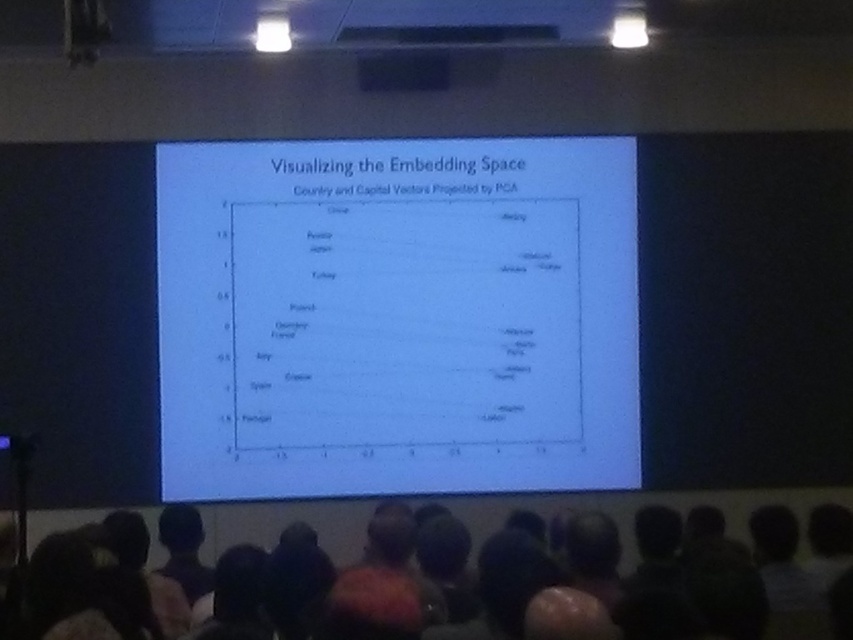
Between white paper at center and black matte rectangle at upper center, which one has less height?

black matte rectangle at upper center

Who is more forward, (x=519, y=184) or (x=357, y=61)?

Positioned in front is point (x=357, y=61).

This screenshot has width=853, height=640. Find the location of `white paper at center`. white paper at center is located at coordinates (397, 316).

The height and width of the screenshot is (640, 853). Describe the element at coordinates (286, 516) in the screenshot. I see `dark hair at lower center` at that location.

Which is behind, point (502, 513) or point (440, 52)?

Positioned behind is point (502, 513).

Image resolution: width=853 pixels, height=640 pixels. What are the coordinates of `dark hair at lower center` in the screenshot? It's located at tap(286, 516).

Is point (279, 456) farther from camera compared to point (167, 600)?

Yes, point (279, 456) is behind point (167, 600).

Who is higher up, white paper at center or dark hair at lower center?

white paper at center

Where is `white paper at center`? white paper at center is located at coordinates (397, 316).